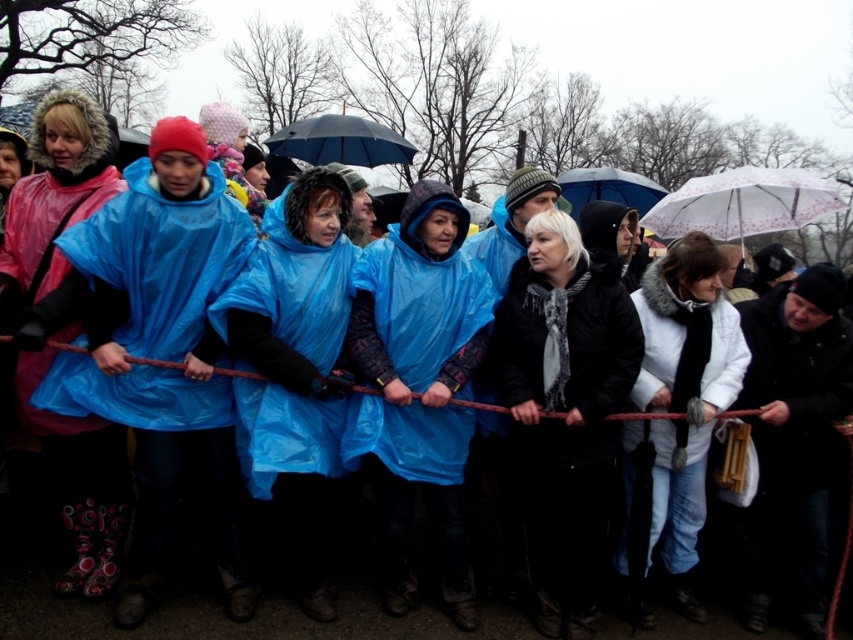
From the picture: Who is lower down, black matte jacket at center or transparent plastic umbrella at center?

black matte jacket at center is lower down.

Between point (556, 518) and point (635, 196), which one is positioned behind?

Positioned behind is point (635, 196).

I want to click on black matte jacket at center, so click(564, 408).

Can you confirm if blue glossy poncho at center is positioned to the left of pink matte raincoat at left?

In fact, blue glossy poncho at center is to the right of pink matte raincoat at left.

Can you confirm if blue glossy poncho at center is smaller than pink matte raincoat at left?

No, blue glossy poncho at center is not smaller than pink matte raincoat at left.

The image size is (853, 640). I want to click on blue glossy poncho at center, so click(294, 371).

The width and height of the screenshot is (853, 640). I want to click on blue glossy poncho at center, so [294, 371].

Can you confirm if matte black umbrella at center is positioned above transparent plastic umbrella at center?

Actually, matte black umbrella at center is below transparent plastic umbrella at center.

Describe the element at coordinates (340, 141) in the screenshot. I see `matte black umbrella at center` at that location.

Where is `matte black umbrella at center`? matte black umbrella at center is located at coordinates (340, 141).